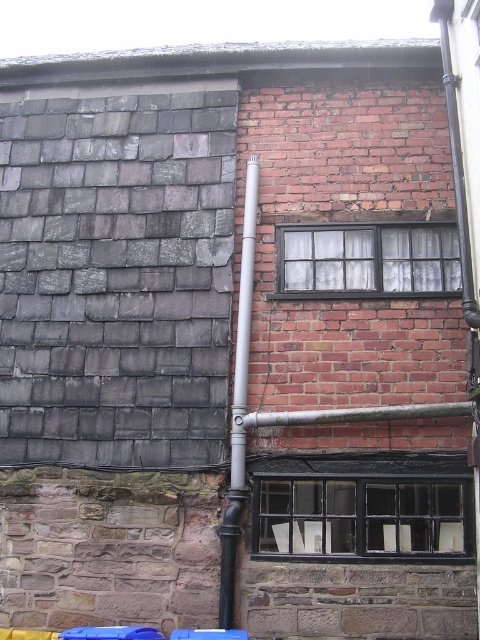
Which is above, black painted wood window at lower center or silver metallic pipe at center?

black painted wood window at lower center

Is point (295, 502) positioned after point (224, 545)?

Yes, point (295, 502) is behind point (224, 545).

Find the location of a particular element. black painted wood window at lower center is located at coordinates [361, 516].

Is black painted wood window at lower center above matte black window at center?

Actually, black painted wood window at lower center is below matte black window at center.

Where is `black painted wood window at lower center`? The height and width of the screenshot is (640, 480). black painted wood window at lower center is located at coordinates coord(361,516).

Is point (336, 289) behind point (236, 524)?

Yes, point (336, 289) is farther from viewer.

Does matte black window at center appear over silver metallic pipe at center?

Correct, matte black window at center is located above silver metallic pipe at center.

Image resolution: width=480 pixels, height=640 pixels. What do you see at coordinates (368, 259) in the screenshot?
I see `matte black window at center` at bounding box center [368, 259].

Where is `matte black window at center`? Image resolution: width=480 pixels, height=640 pixels. matte black window at center is located at coordinates pos(368,259).